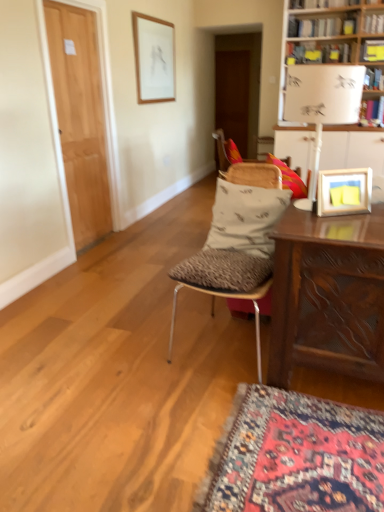
Identify the location of vacant space to the left of mahogany wood desk at right. (224, 399).